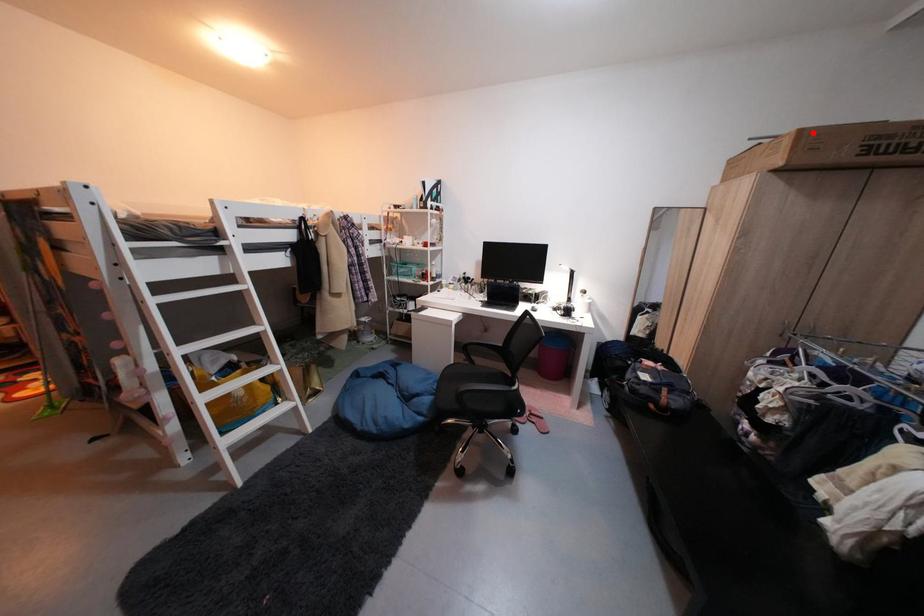
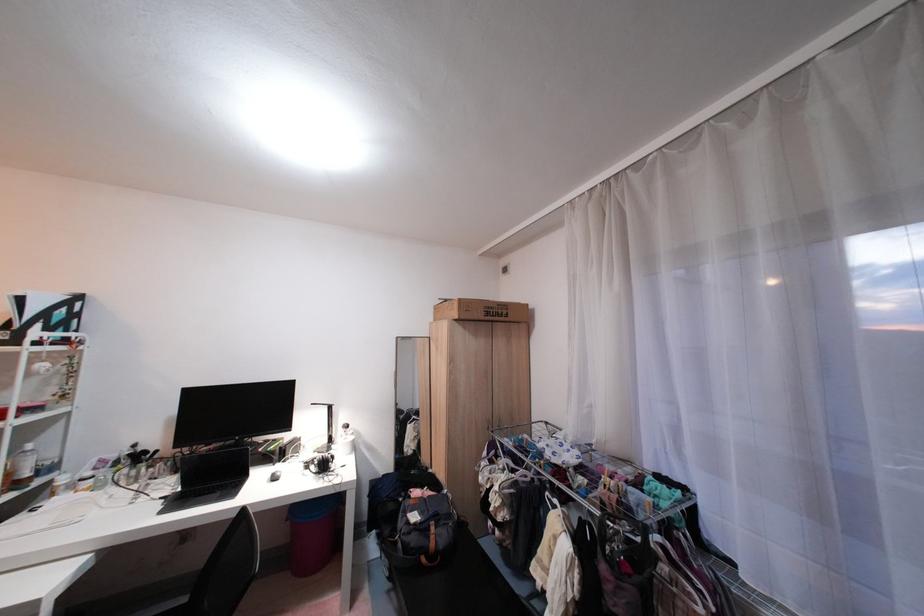
Question: I am providing you with two images of the same scene from different viewpoints. Image1 has a red point marked. In image2, the corresponding 3D location appears at what relative position? Reply with the corresponding letter.

Choices:
 (A) Closer
 (B) Farther

Answer: (A)